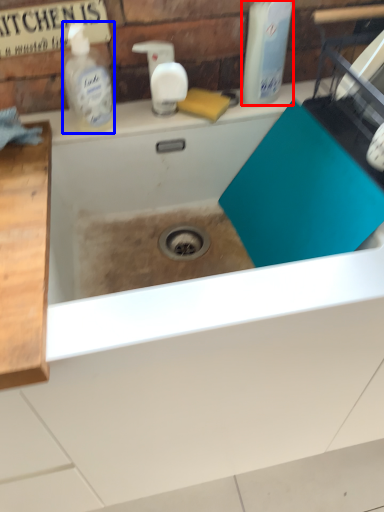
Question: Which of the following is the farthest to the observer, cleaning product (highlighted by a red box) or cleaning product (highlighted by a blue box)?

Choices:
 (A) cleaning product
 (B) cleaning product

Answer: (B)